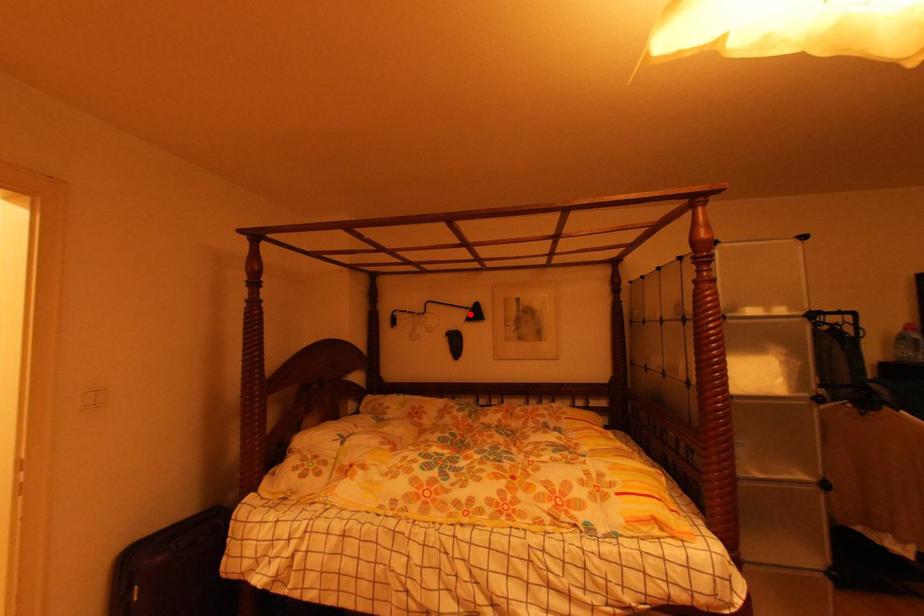
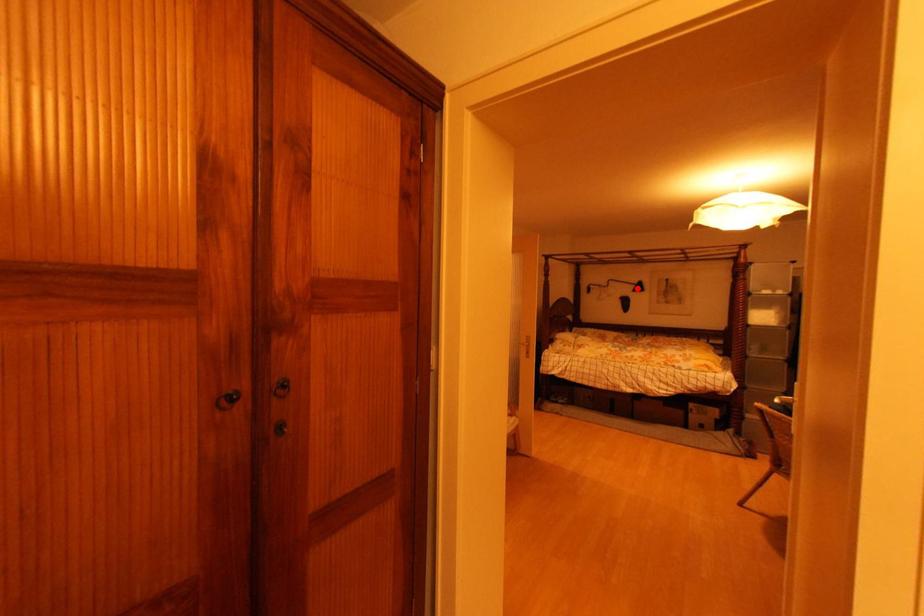
I am providing you with two images of the same scene from different viewpoints. A red point is marked on the first image and another point is marked on the second image. Do the highlighted points in image1 and image2 indicate the same real-world spot?

Yes